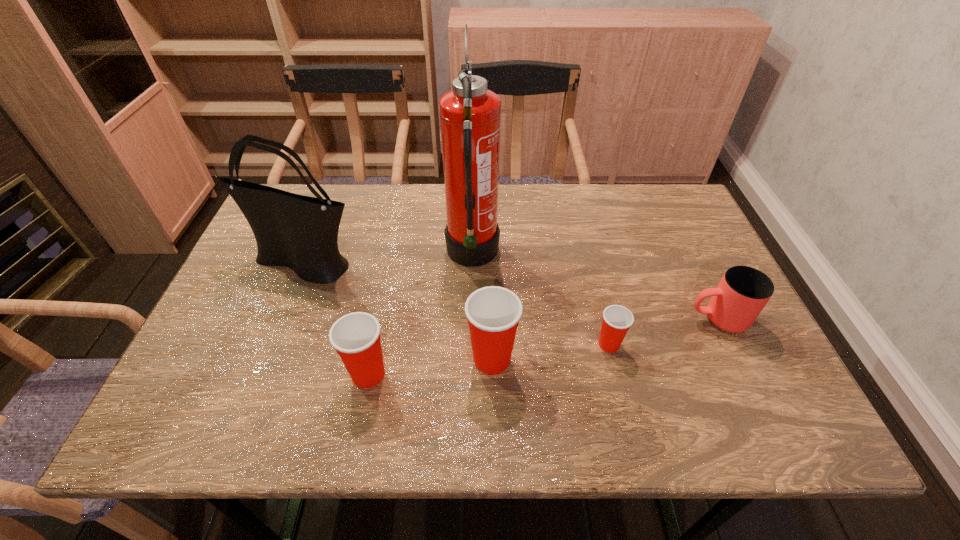
All Dixie cups are currently evenly spaced. To continue this pattern, where would you add another Dixie cup on the right? Please point out a vacant spot. Please provide its 2D coordinates. Your answer should be formatted as a tuple, i.e. [(x, y)], where the tuple contains the x and y coordinates of a point satisfying the conditions above.

[(720, 330)]